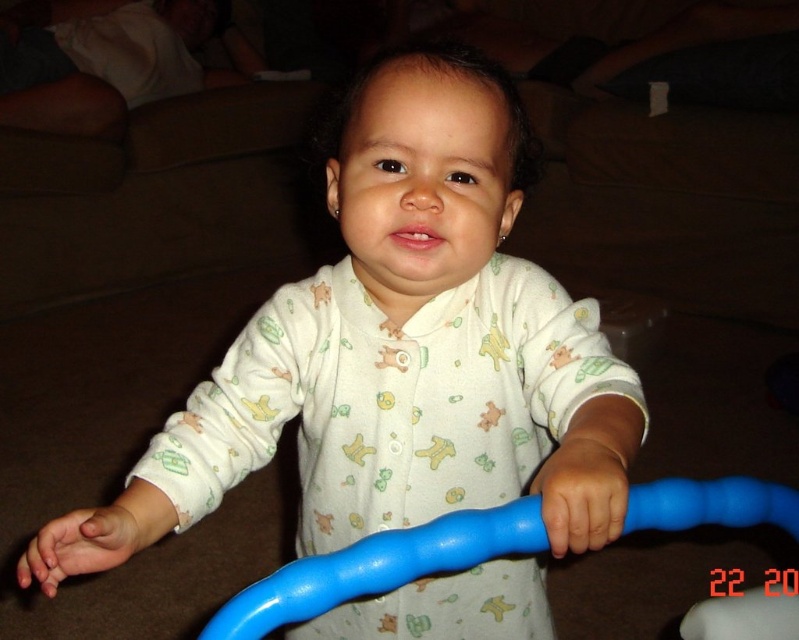
How much distance is there between white soft baby at center and blue rubber handle at center?

They are 9.66 inches apart.

Consider the image. Which is above, white soft baby at center or blue rubber handle at center?

blue rubber handle at center is higher up.

What are the coordinates of `white soft baby at center` in the screenshot? It's located at (398, 349).